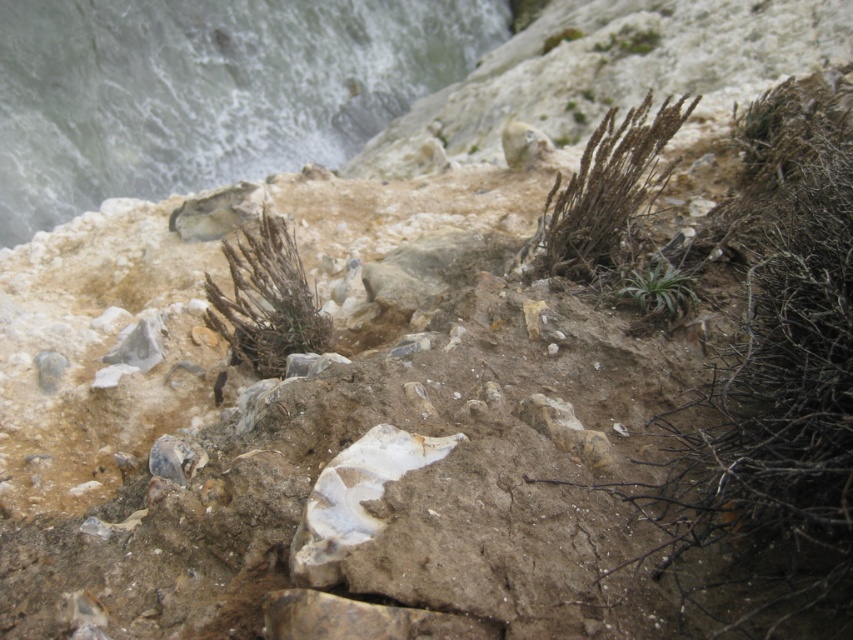
Question: Considering the real-world distances, which object is closest to the white frothy water at upper left?

Choices:
 (A) brown dry grass at upper center
 (B) brown textured plant at center

Answer: (B)

Question: Among these points, which one is nearest to the camera?

Choices:
 (A) (608, 125)
 (B) (171, 168)

Answer: (A)

Question: Does brown textured plant at center have a larger size compared to green leafy plant at center?

Choices:
 (A) no
 (B) yes

Answer: (B)

Question: Considering the relative positions of brown textured plant at center and green leafy plant at center in the image provided, where is brown textured plant at center located with respect to green leafy plant at center?

Choices:
 (A) above
 (B) below

Answer: (B)

Question: Which object is farther from the camera taking this photo?

Choices:
 (A) brown dry grass at upper center
 (B) green leafy plant at center
 (C) white frothy water at upper left
 (D) brown textured plant at center

Answer: (C)

Question: Is white frothy water at upper left above brown textured plant at center?

Choices:
 (A) no
 (B) yes

Answer: (B)